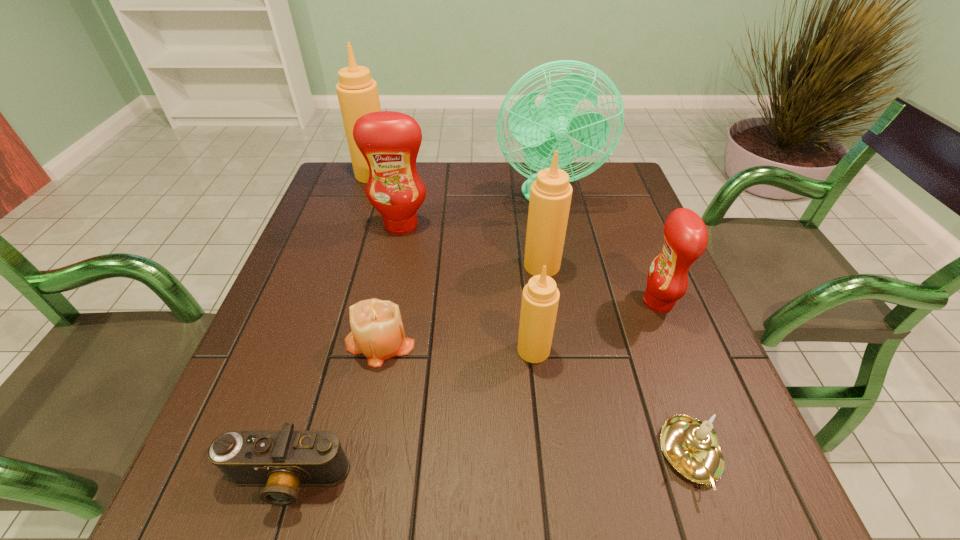
Where is `condiment that is at the right edge`? condiment that is at the right edge is located at coordinates (685, 234).

Locate an element on the screen. This screenshot has width=960, height=540. candle holder that is at the right edge is located at coordinates (691, 446).

Identify the location of object that is positioned at the far left corner. (357, 92).

The image size is (960, 540). I want to click on object positioned at the near left corner, so click(x=282, y=460).

Identify the location of object that is at the far right corner. Image resolution: width=960 pixels, height=540 pixels. (546, 128).

What are the coordinates of `object that is at the near right corner` in the screenshot? It's located at (691, 446).

In the image, there is a desktop. Identify the location of vacant space at the near edge. (497, 491).

Where is `vacant area at the right edge of the desktop`? The width and height of the screenshot is (960, 540). vacant area at the right edge of the desktop is located at coordinates (632, 274).

Find the location of a particular element. free space at the far left corner of the desktop is located at coordinates (348, 206).

In the image, there is a desktop. Where is `vacant space at the near left corner`? This screenshot has width=960, height=540. vacant space at the near left corner is located at coordinates (211, 480).